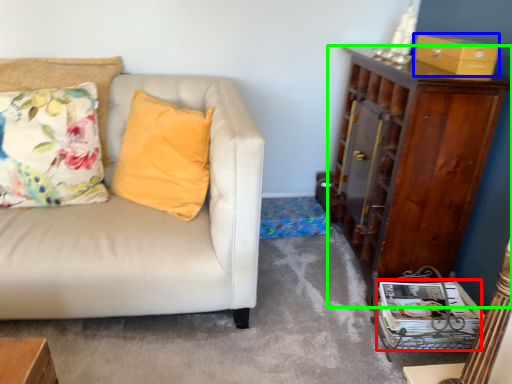
Question: Considering the real-world distances, which object is closest to magazine (highlighted by a red box)? box (highlighted by a blue box) or cabinetry (highlighted by a green box).

Choices:
 (A) box
 (B) cabinetry

Answer: (B)